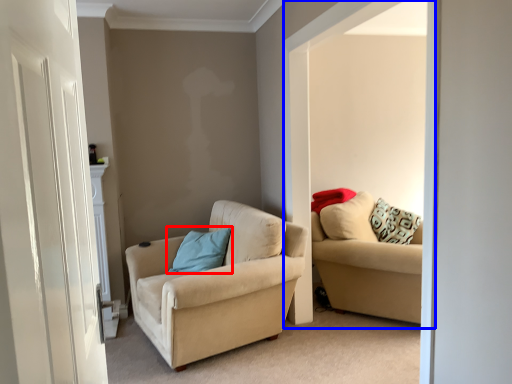
Question: Which object appears closest to the camera in this image, pillow (highlighted by a red box) or window (highlighted by a blue box)?

Choices:
 (A) pillow
 (B) window

Answer: (B)